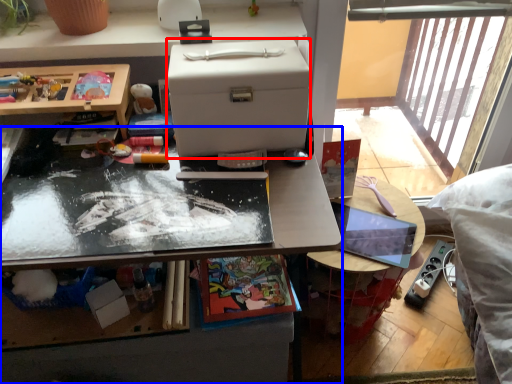
Question: Which of the following is the farthest to the observer, box (highlighted by a red box) or desk (highlighted by a blue box)?

Choices:
 (A) box
 (B) desk

Answer: (B)